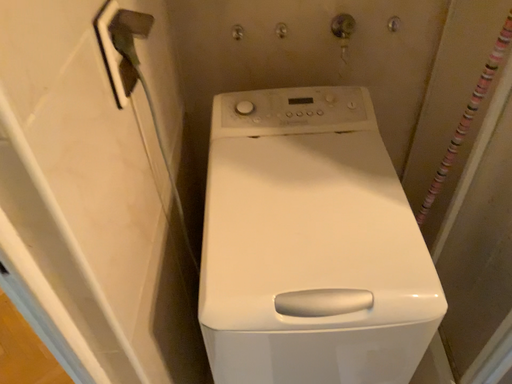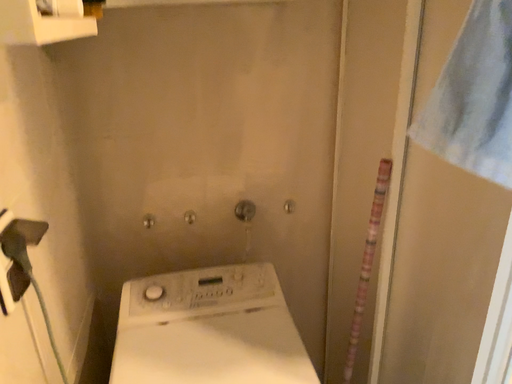
Question: Which way did the camera rotate in the video?

Choices:
 (A) rotated left
 (B) rotated right

Answer: (B)